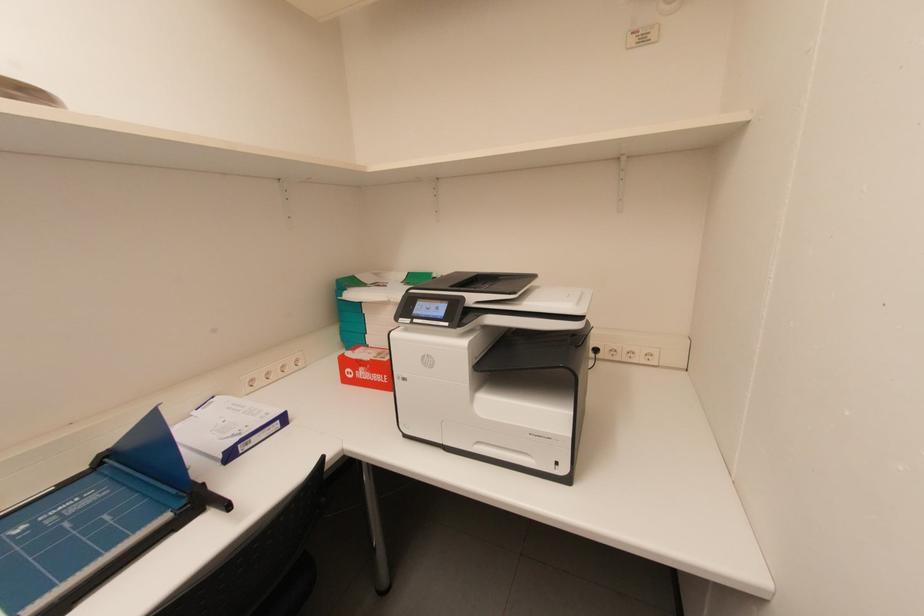
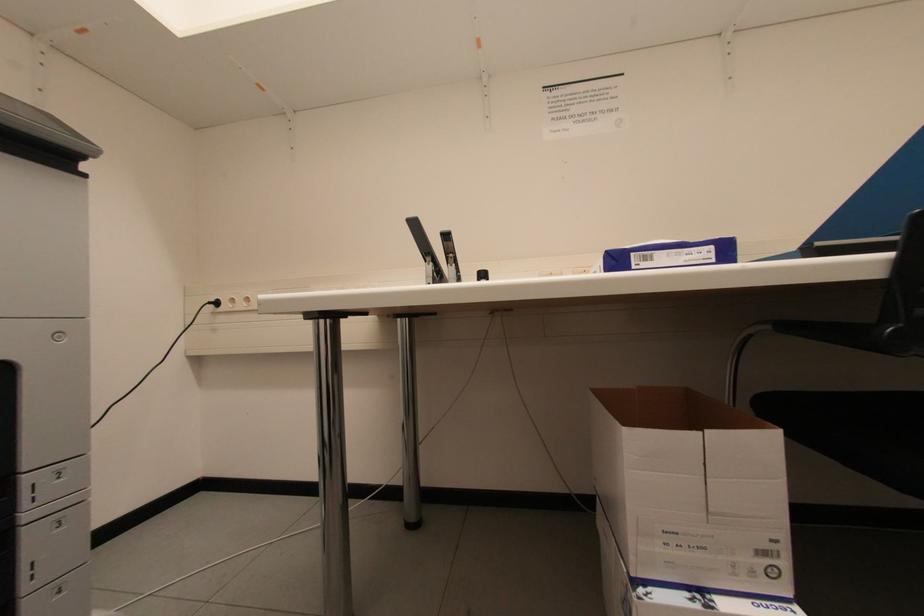
Question: The images are taken continuously from a first-person perspective. In which direction is your viewpoint rotating?

Choices:
 (A) Left
 (B) Right
 (C) Up
 (D) Down

Answer: (A)